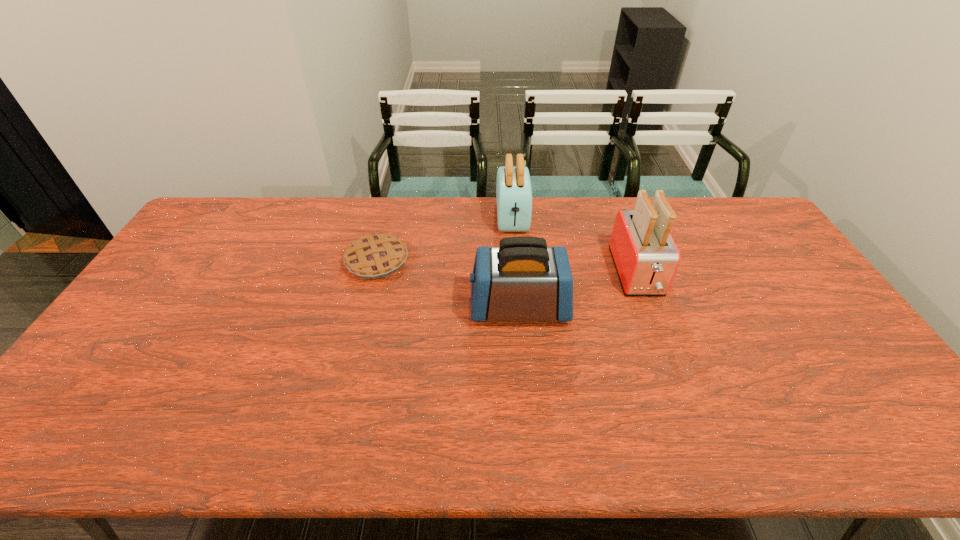
I want to click on vacant space at the left edge, so click(x=186, y=263).

Image resolution: width=960 pixels, height=540 pixels. I want to click on vacant region at the right edge of the desktop, so click(x=796, y=285).

The image size is (960, 540). I want to click on vacant area between the rightmost toaster and the farthest object, so click(x=574, y=245).

Identify the location of free space between the farthest object and the pie. The image size is (960, 540). (444, 239).

The image size is (960, 540). I want to click on empty space that is in between the farthest object and the leftmost object, so click(444, 239).

Point out which object is positioned as the second nearest to the shortest object. Please provide its 2D coordinates. Your answer should be formatted as a tuple, i.e. [(x, y)], where the tuple contains the x and y coordinates of a point satisfying the conditions above.

[(513, 186)]

Point out which object is positioned as the nearest to the shortest object. Please provide its 2D coordinates. Your answer should be formatted as a tuple, i.e. [(x, y)], where the tuple contains the x and y coordinates of a point satisfying the conditions above.

[(521, 280)]

Choose which toaster is the second nearest neighbor to the shortest object. Please provide its 2D coordinates. Your answer should be formatted as a tuple, i.e. [(x, y)], where the tuple contains the x and y coordinates of a point satisfying the conditions above.

[(513, 186)]

The height and width of the screenshot is (540, 960). I want to click on toaster object that ranks as the second closest to the farthest object, so click(645, 255).